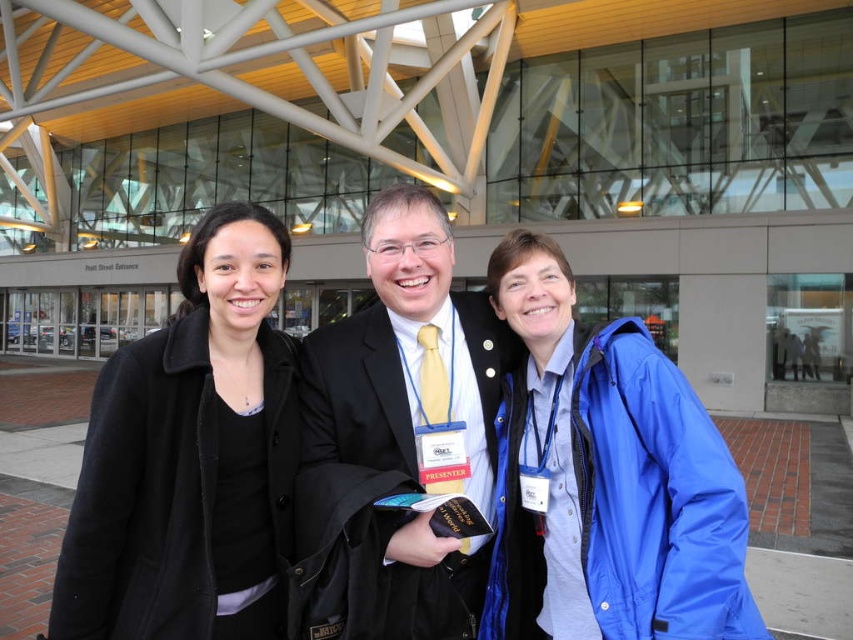
Question: Which point is closer to the camera taking this photo?

Choices:
 (A) (376, 536)
 (B) (738, 588)

Answer: (B)

Question: From the image, what is the correct spatial relationship of black matte coat at left in relation to blue matte jacket at right?

Choices:
 (A) below
 (B) above

Answer: (B)

Question: Is black matte coat at left closer to the viewer compared to matte black suit at center?

Choices:
 (A) yes
 (B) no

Answer: (B)

Question: Does black matte coat at left have a greater width compared to matte black suit at center?

Choices:
 (A) no
 (B) yes

Answer: (A)

Question: Which is farther from the matte black suit at center?

Choices:
 (A) black matte coat at left
 (B) blue matte jacket at right

Answer: (A)

Question: Which object is closer to the camera taking this photo?

Choices:
 (A) black matte coat at left
 (B) blue matte jacket at right
 (C) matte black suit at center

Answer: (B)